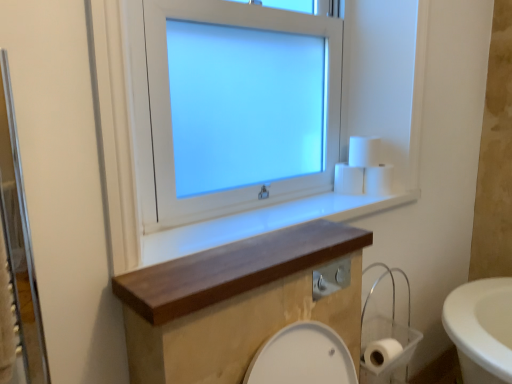
You are a GUI agent. You are given a task and a screenshot of the screen. Output one action in this format:
    pyautogui.click(x=<x>, y=<y>)
    Task: Click on the empty space that is ontop of wooden shelf at center (from a real-world perspective)
    
    Given the screenshot: What is the action you would take?
    pyautogui.click(x=256, y=255)